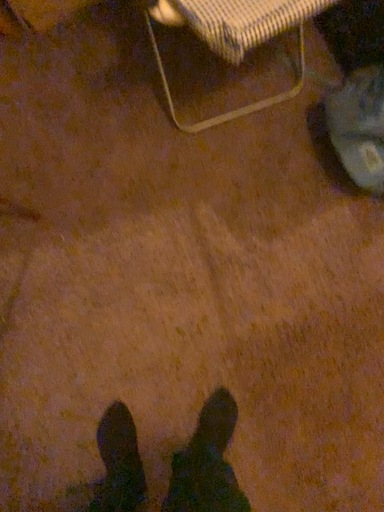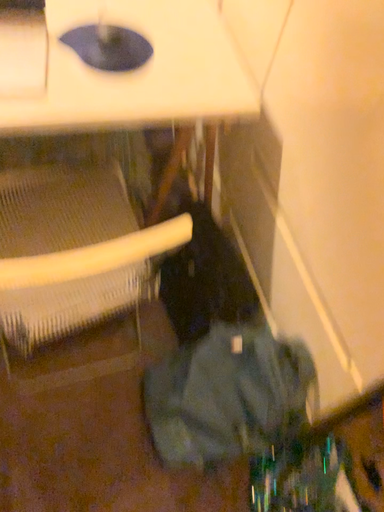
Question: Which way did the camera rotate in the video?

Choices:
 (A) rotated left
 (B) rotated right

Answer: (B)